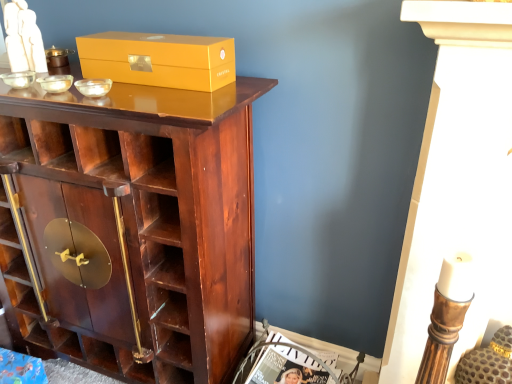
This screenshot has height=384, width=512. Find the location of `shiny dark wood cupboard at center`. shiny dark wood cupboard at center is located at coordinates (135, 226).

This screenshot has width=512, height=384. Find the location of `matte white magazine at lower center`. matte white magazine at lower center is located at coordinates (290, 348).

Where is `matte gold box at upper center`? matte gold box at upper center is located at coordinates (159, 59).

Where is `magazine that is below the matte gold box at upper center (from the image's perspective)`? The image size is (512, 384). magazine that is below the matte gold box at upper center (from the image's perspective) is located at coordinates (290, 348).

Considering the sizes of objects matte gold box at upper center and matte white magazine at lower center in the image provided, who is wider, matte gold box at upper center or matte white magazine at lower center?

With larger width is matte white magazine at lower center.

Could you tell me if matte gold box at upper center is facing matte white magazine at lower center?

No, matte gold box at upper center is not aimed at matte white magazine at lower center.

Considering the positions of objects matte gold box at upper center and matte white magazine at lower center in the image provided, who is more to the right, matte gold box at upper center or matte white magazine at lower center?

matte white magazine at lower center.

Is point (170, 40) less distant than point (109, 111)?

No, it is not.

From the image's perspective, who appears lower, matte gold box at upper center or shiny dark wood cupboard at center?

shiny dark wood cupboard at center.

From the picture: Does matte white magazine at lower center turn towards shiny dark wood cupboard at center?

No, matte white magazine at lower center is not facing towards shiny dark wood cupboard at center.

From a real-world perspective, is matte white magazine at lower center located higher than shiny dark wood cupboard at center?

No, from a real-world perspective, matte white magazine at lower center is not on top of shiny dark wood cupboard at center.

Can you confirm if matte white magazine at lower center is positioned to the left of shiny dark wood cupboard at center?

No, matte white magazine at lower center is not to the left of shiny dark wood cupboard at center.

Can you tell me how much matte white magazine at lower center and shiny dark wood cupboard at center differ in facing direction?

There is a 0.00021-degree angle between the facing directions of matte white magazine at lower center and shiny dark wood cupboard at center.

In the image, is shiny dark wood cupboard at center positioned in front of or behind matte white magazine at lower center?

Clearly, shiny dark wood cupboard at center is in front of matte white magazine at lower center.

From a real-world perspective, between shiny dark wood cupboard at center and matte white magazine at lower center, who is vertically higher?

shiny dark wood cupboard at center, from a real-world perspective.

Can you confirm if shiny dark wood cupboard at center is thinner than matte white magazine at lower center?

Incorrect, the width of shiny dark wood cupboard at center is not less than that of matte white magazine at lower center.

Between point (272, 342) and point (127, 65), which one is positioned in front?

Point (127, 65)

Which of these two, matte white magazine at lower center or matte gold box at upper center, is wider?

Answer: matte white magazine at lower center is wider.

The image size is (512, 384). What are the coordinates of `magazine below the matte gold box at upper center (from a real-world perspective)` in the screenshot? It's located at (290, 348).

Considering the positions of objects shiny dark wood cupboard at center and matte gold box at upper center in the image provided, who is more to the right, shiny dark wood cupboard at center or matte gold box at upper center?

From the viewer's perspective, matte gold box at upper center appears more on the right side.

Measure the distance between shiny dark wood cupboard at center and matte gold box at upper center.

shiny dark wood cupboard at center and matte gold box at upper center are 13.51 inches apart from each other.

Is shiny dark wood cupboard at center shorter than matte gold box at upper center?

No, shiny dark wood cupboard at center is not shorter than matte gold box at upper center.

Is shiny dark wood cupboard at center turned away from matte gold box at upper center?

No, shiny dark wood cupboard at center is not facing the opposite direction of matte gold box at upper center.

Where is `magazine that is behind the matte gold box at upper center`? This screenshot has height=384, width=512. magazine that is behind the matte gold box at upper center is located at coordinates (290, 348).

This screenshot has width=512, height=384. I want to click on box on the right of the shiny dark wood cupboard at center, so click(x=159, y=59).

Estimate the real-world distances between objects in this image. Which object is further from matte gold box at upper center, shiny dark wood cupboard at center or matte white magazine at lower center?

matte white magazine at lower center lies further to matte gold box at upper center than the other object.

Estimate the real-world distances between objects in this image. Which object is closer to shiny dark wood cupboard at center, matte gold box at upper center or matte white magazine at lower center?

matte gold box at upper center is closer to shiny dark wood cupboard at center.

Estimate the real-world distances between objects in this image. Which object is further from matte gold box at upper center, matte white magazine at lower center or shiny dark wood cupboard at center?

matte white magazine at lower center.

Considering their positions, is shiny dark wood cupboard at center positioned further to matte white magazine at lower center than matte gold box at upper center?

matte gold box at upper center.

From the image, which object appears to be nearer to shiny dark wood cupboard at center, matte white magazine at lower center or matte gold box at upper center?

matte gold box at upper center is closer to shiny dark wood cupboard at center.

Estimate the real-world distances between objects in this image. Which object is closer to matte white magazine at lower center, matte gold box at upper center or shiny dark wood cupboard at center?

The object closer to matte white magazine at lower center is shiny dark wood cupboard at center.

Find the location of a particular element. The width and height of the screenshot is (512, 384). cupboard between matte gold box at upper center and matte white magazine at lower center from top to bottom is located at coordinates (135, 226).